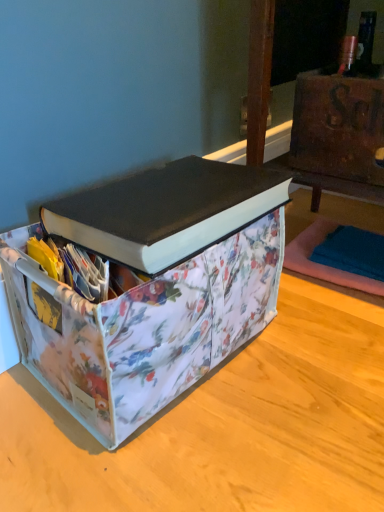
Find the location of a particular element. This screenshot has height=512, width=384. vacant area that is in front of floral fabric storage bin at lower right is located at coordinates (317, 344).